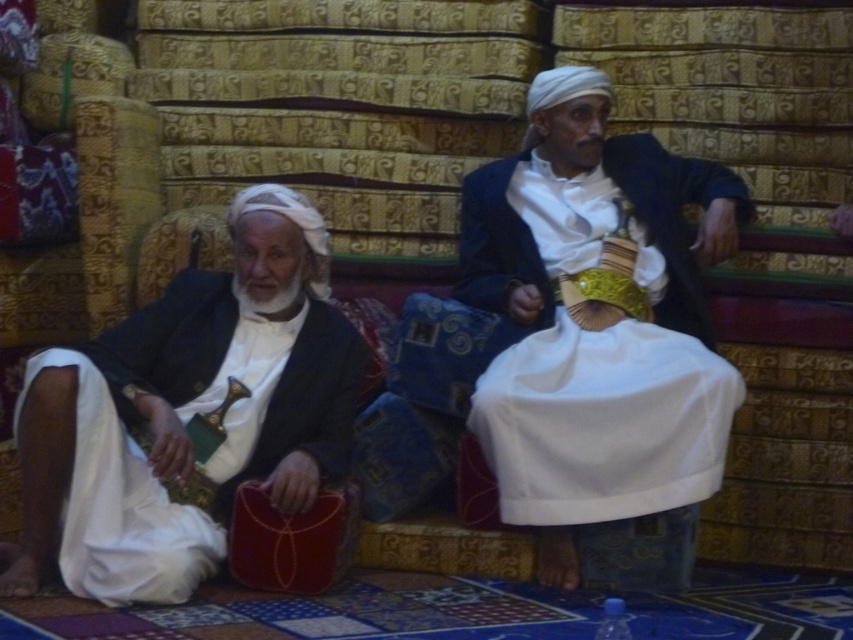
Question: From the image, what is the correct spatial relationship of matte black jacket at center in relation to matte black suit at left?

Choices:
 (A) below
 (B) above

Answer: (B)

Question: Is matte black jacket at center above matte black suit at left?

Choices:
 (A) yes
 (B) no

Answer: (A)

Question: Does matte black jacket at center have a lesser width compared to matte black suit at left?

Choices:
 (A) no
 (B) yes

Answer: (B)

Question: Which point appears closest to the camera in this image?

Choices:
 (A) (335, 403)
 (B) (498, 301)

Answer: (A)